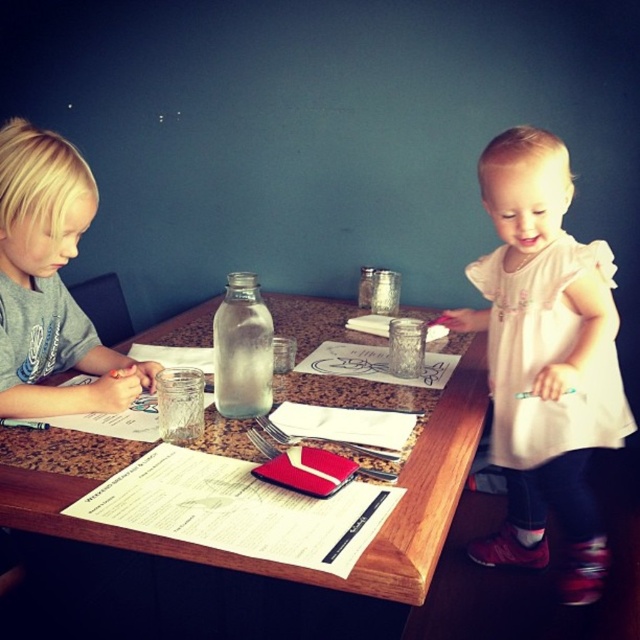
Is brown wood table at center to the right of smooth gray shirt at left from the viewer's perspective?

Indeed, brown wood table at center is positioned on the right side of smooth gray shirt at left.

Can you confirm if brown wood table at center is thinner than smooth gray shirt at left?

Incorrect, brown wood table at center's width is not less than smooth gray shirt at left's.

Is point (188, 328) less distant than point (38, 262)?

No, it is behind (38, 262).

Identify the location of brown wood table at center. (260, 560).

Which of these two, white cotton dress at upper right or smooth gray shirt at left, stands shorter?

→ With less height is smooth gray shirt at left.

Between point (536, 417) and point (29, 348), which one is positioned in front?

Point (29, 348) is more forward.

Identify the location of white cotton dress at upper right. The width and height of the screenshot is (640, 640). (545, 358).

Between white cotton dress at upper right and brown wood table at center, which one is positioned lower?

white cotton dress at upper right is lower down.

Is point (541, 524) less distant than point (408, 524)?

That is False.

Is point (486, 372) less distant than point (205, 557)?

That is False.

Locate an element on the screen. The height and width of the screenshot is (640, 640). white cotton dress at upper right is located at coordinates (545, 358).